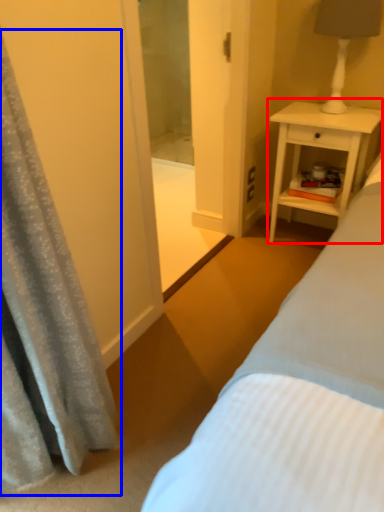
Question: Which point is closer to the camera, nightstand (highlighted by a red box) or curtain (highlighted by a blue box)?

Choices:
 (A) nightstand
 (B) curtain

Answer: (B)